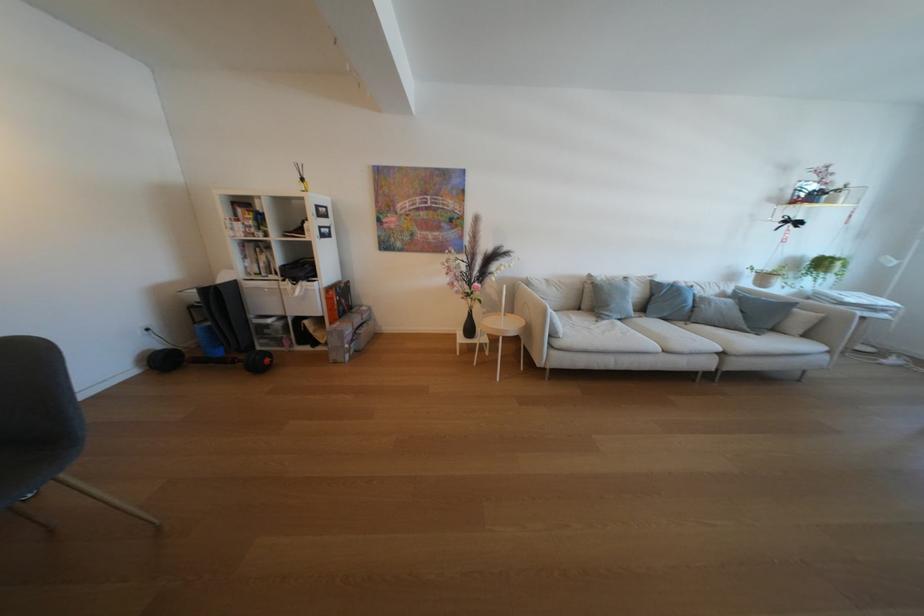
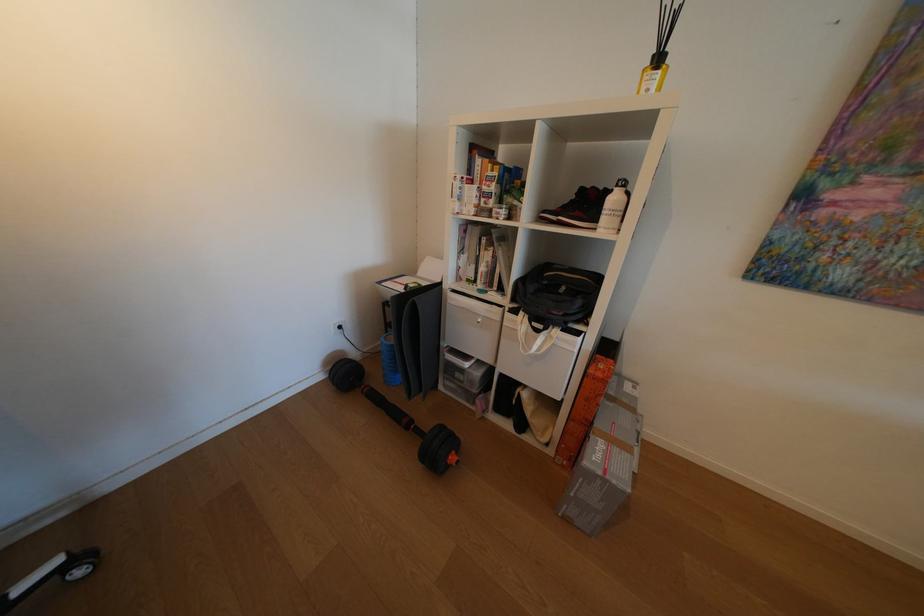
The point at [349,331] is marked in the first image. Where is the corresponding point in the second image?

(626, 483)